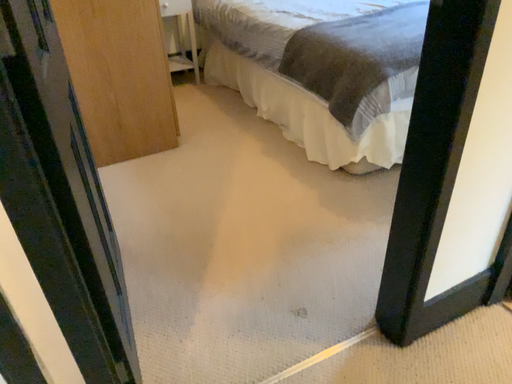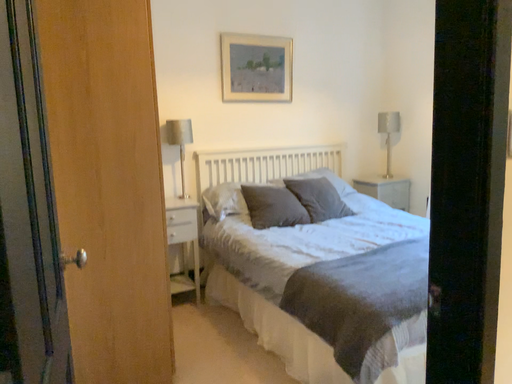
Question: Which way did the camera rotate in the video?

Choices:
 (A) rotated upward
 (B) rotated downward

Answer: (A)